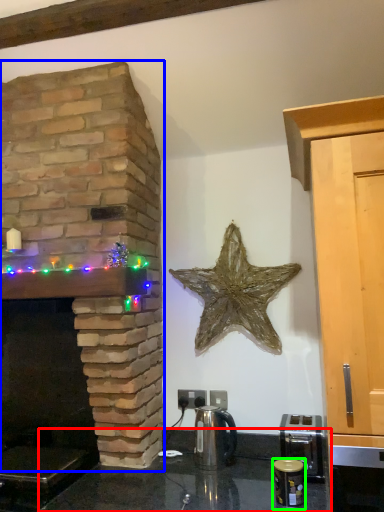
Question: Considering the real-world distances, which object is farthest from counter top (highlighted by a red box)? fireplace (highlighted by a blue box) or appliance (highlighted by a green box)?

Choices:
 (A) fireplace
 (B) appliance

Answer: (A)